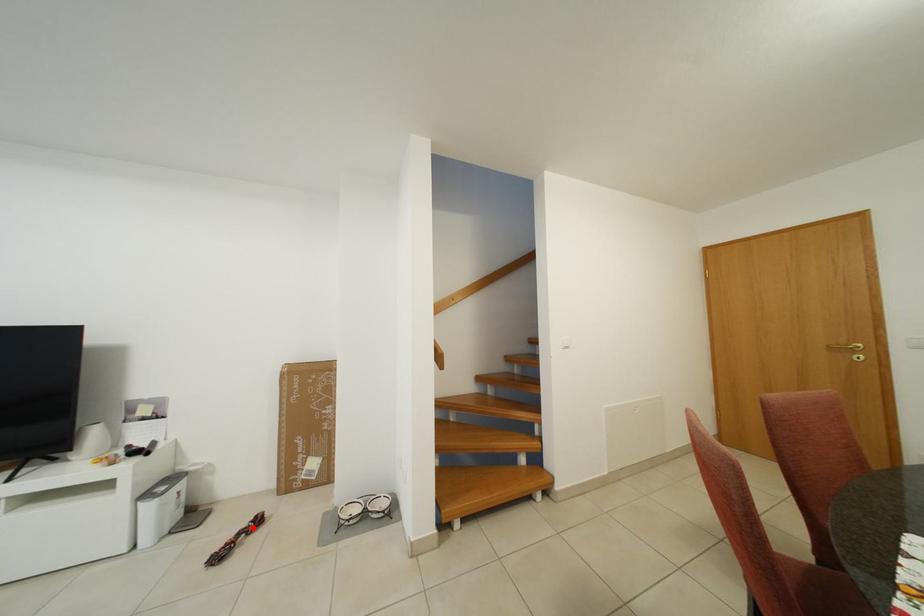
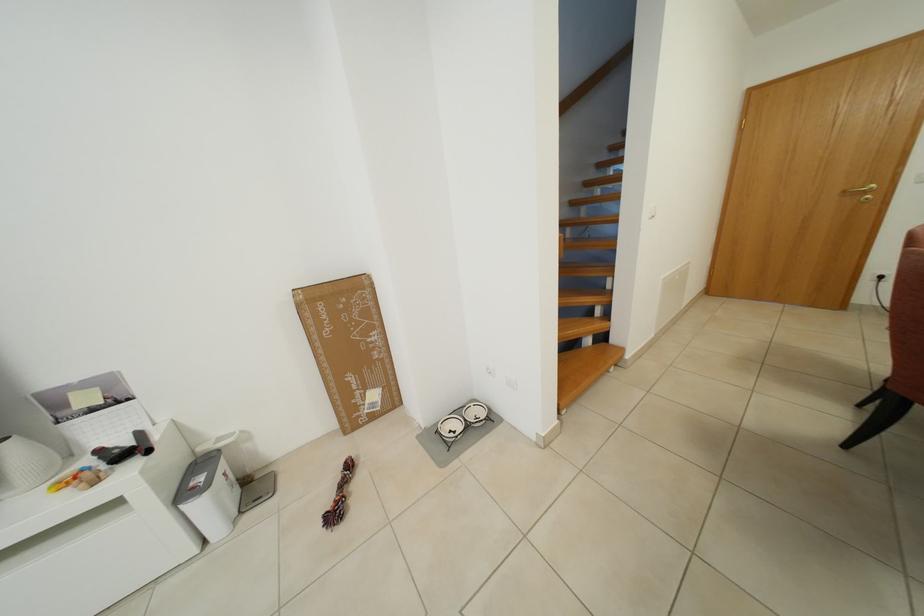
Question: I am providing you with two images of the same scene from different viewpoints. Image1 has a red point marked. In image2, the corresponding 3D location appears at what relative position? Reply with the corresponding letter.

Choices:
 (A) Closer
 (B) Farther

Answer: (A)